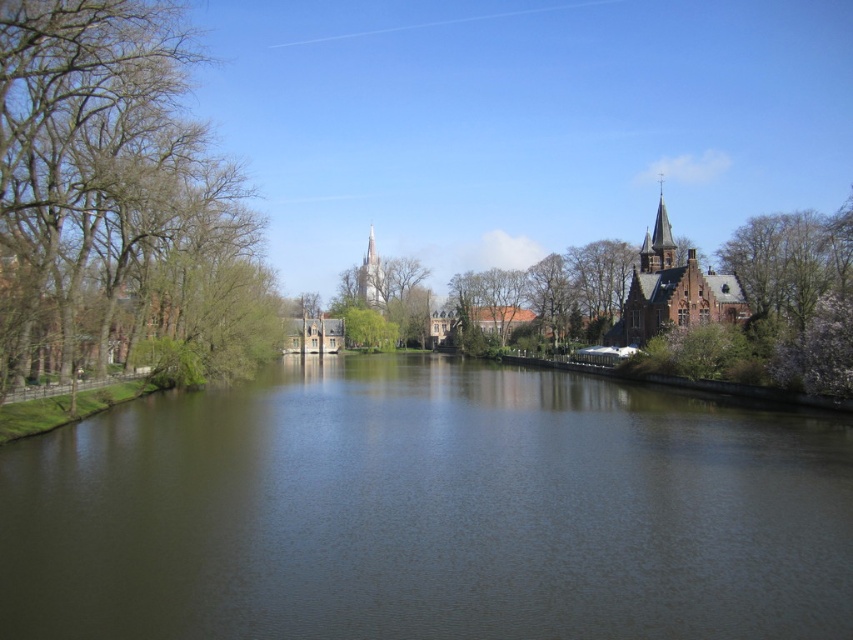
You are a photographer planning to capture the cherry blossom tree at right and the greenish water at center in a single frame. Which object should you position closer to the left side of your camera frame to include both in the composition?

To include both the cherry blossom tree at right and the greenish water at center in the composition, you should position the greenish water at center closer to the left side of your camera frame since it is already on the left side of the cherry blossom tree at right.

You are planning to cross the river using a small boat that can only fit one person at a time. The boat requires a minimum width of 3 meters to safely navigate. Based on the scene, can the boat safely cross the river between the greenish water at center and the cherry blossom tree at right?

The greenish water at center has a width less than the cherry blossom tree at right. Since the boat requires a minimum of 3 meters to navigate safely, and the water width is narrower than the tree, it might not meet the required width. Therefore, the boat may not be able to safely cross the river here.

You are a photographer planning to capture the cherry blossom tree at right and the greenish water at center in a single frame. Given that the camera can only focus on one object at a time, which object should you prioritize to ensure it appears larger in the photo?

The cherry blossom tree at right is larger than the greenish water at center, so you should prioritize focusing on the cherry blossom tree at right to ensure it appears larger in the photo.